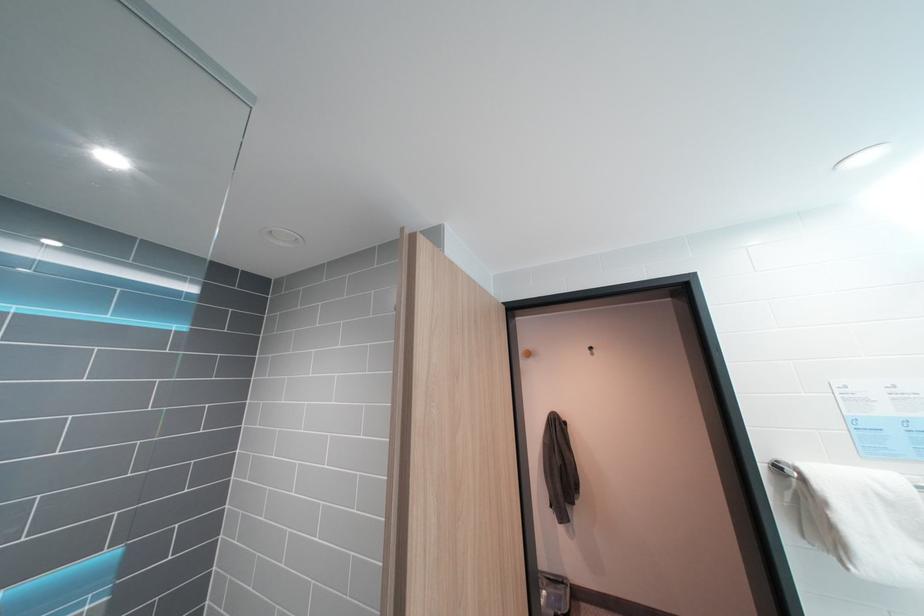
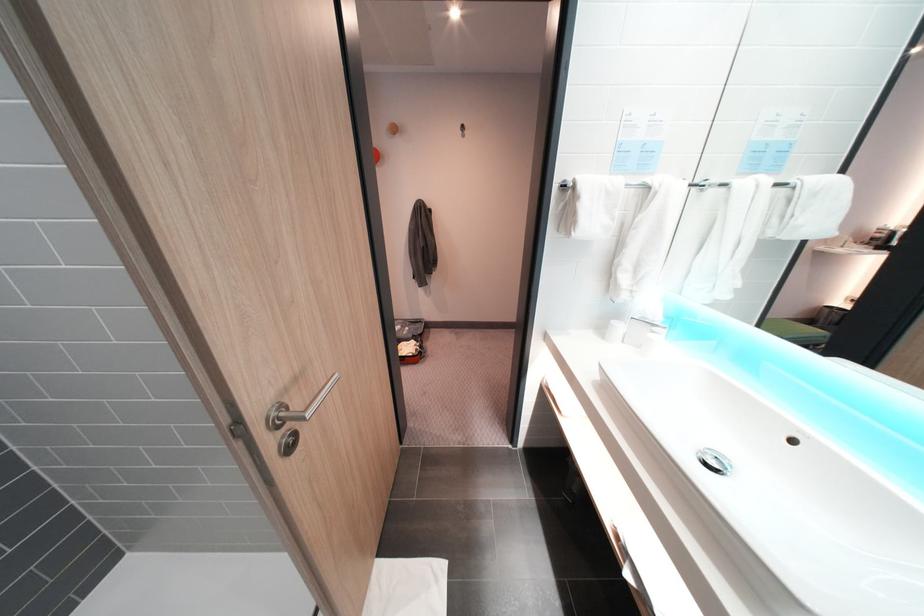
First-person continuous shooting, in which direction is the camera rotating?

The camera rotated toward right-down.